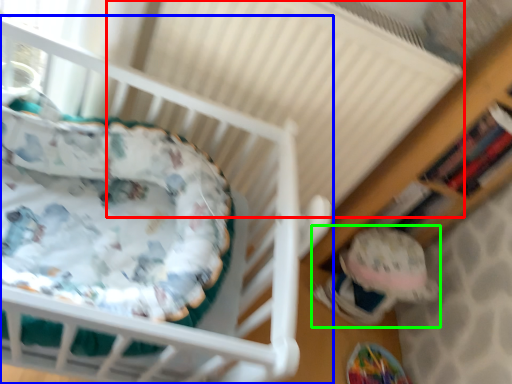
Question: Which object is the closest to the radiator (highlighted by a red box)? Choose among these: infant bed (highlighted by a blue box) or toy (highlighted by a green box).

Choices:
 (A) infant bed
 (B) toy

Answer: (A)